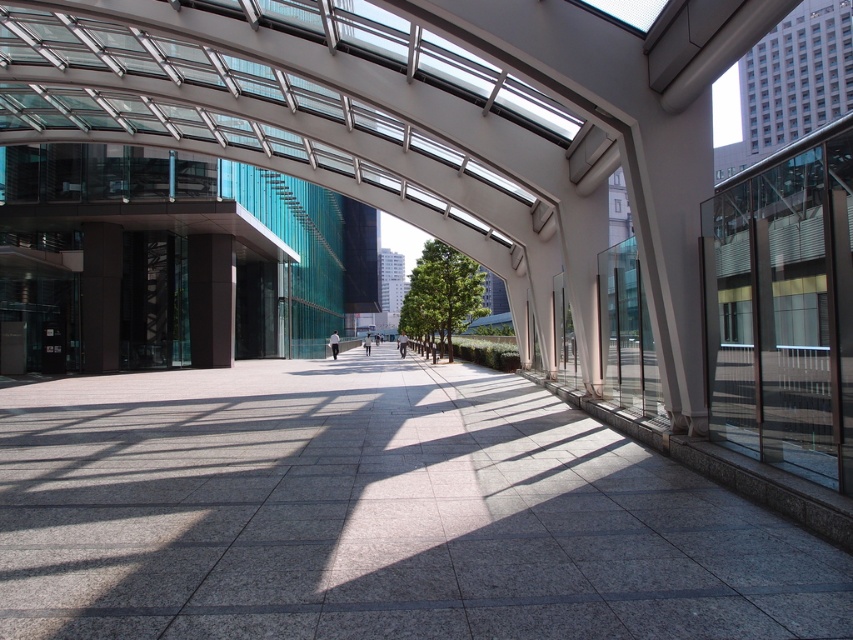
Can you confirm if gray polished stone pavement at center is positioned to the left of satin black pillar at center?

In fact, gray polished stone pavement at center is to the right of satin black pillar at center.

Can you confirm if gray polished stone pavement at center is smaller than satin black pillar at center?

Actually, gray polished stone pavement at center might be larger than satin black pillar at center.

Find the location of a particular element. The width and height of the screenshot is (853, 640). gray polished stone pavement at center is located at coordinates (375, 513).

The width and height of the screenshot is (853, 640). What are the coordinates of `gray polished stone pavement at center` in the screenshot? It's located at (375, 513).